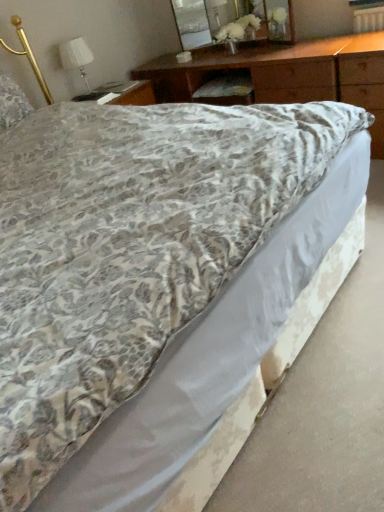
Question: Relative to white fabric lampshade at upper left, is clear glass mirror at upper center in front or behind?

Choices:
 (A) front
 (B) behind

Answer: (A)

Question: Does point (205, 1) appear closer or farther from the camera than point (64, 51)?

Choices:
 (A) farther
 (B) closer

Answer: (A)

Question: Which object is the farthest from the clear glass mirror at upper center?

Choices:
 (A) fluffy white pillow at upper left
 (B) white fabric lampshade at upper left
 (C) wooden at upper center

Answer: (A)

Question: Which is farther from the wooden at upper center?

Choices:
 (A) white fabric lampshade at upper left
 (B) fluffy white pillow at upper left
 (C) clear glass mirror at upper center

Answer: (B)